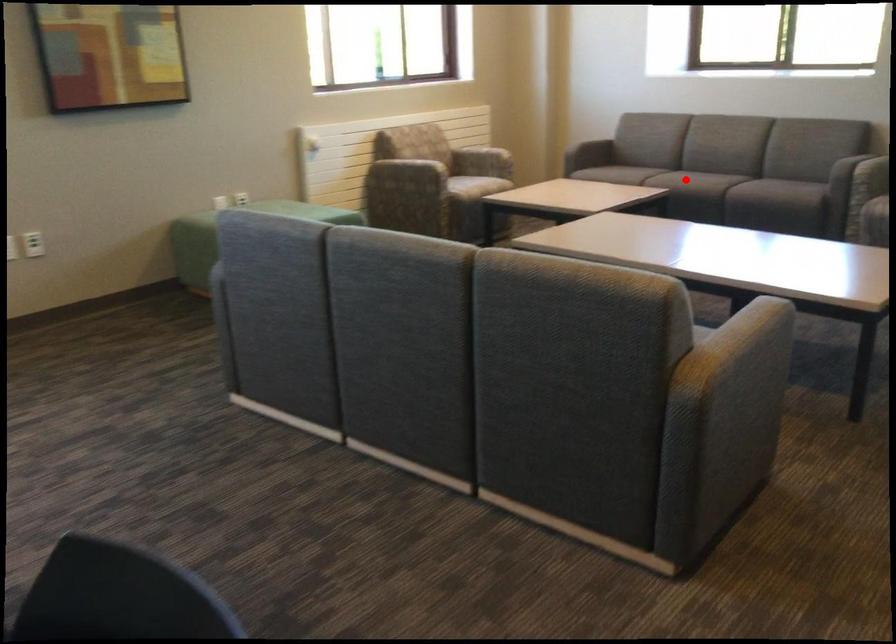
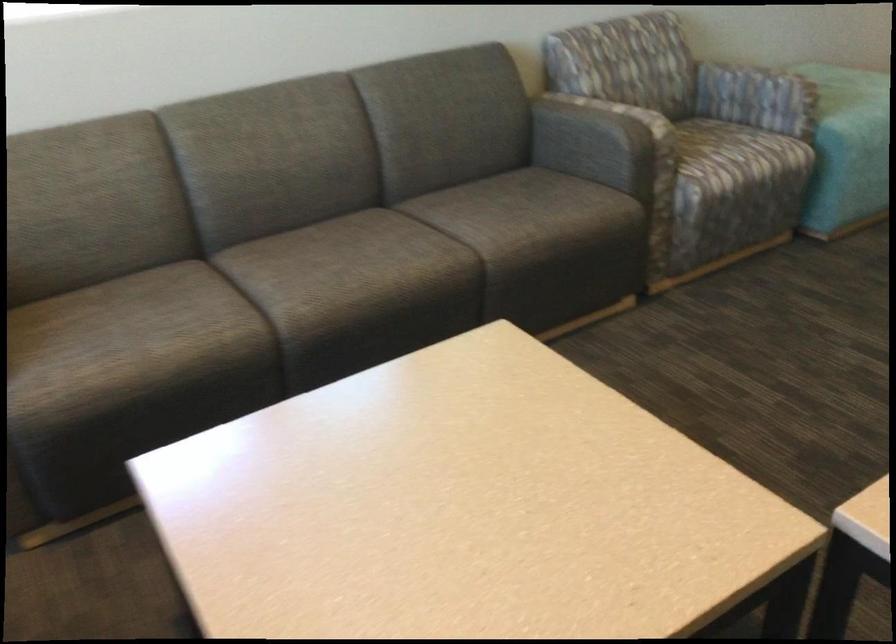
Question: I am providing you with two images of the same scene from different viewpoints. In image1, a red point is highlighted. Considering the same 3D point in image2, which of the following is correct?

Choices:
 (A) It is closer
 (B) It is farther

Answer: (A)